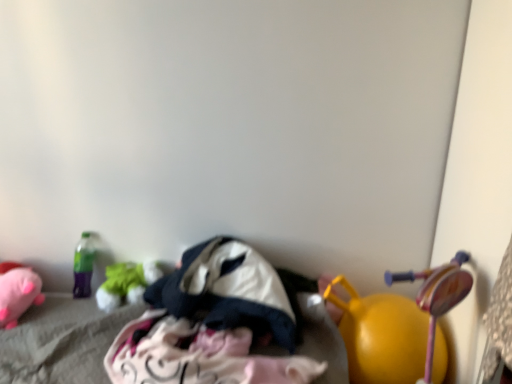
What are the coordinates of `soft pink plush at lower left, the first toy from the left` in the screenshot? It's located at (17, 292).

I want to click on yellow rubber ball at lower right, placed as the first toy when sorted from right to left, so click(x=381, y=335).

Is green fabric toy at left, the second toy in the right-to-left sequence, to the left or to the right of soft pink plush at lower left, the first toy from the left, in the image?

green fabric toy at left, the second toy in the right-to-left sequence, is to the right of soft pink plush at lower left, the first toy from the left.

Starting from the soft pink plush at lower left, the first toy from the left, which toy is the 1st one to the right? Please provide its 2D coordinates.

[(126, 283)]

From a real-world perspective, does green fabric toy at left, the second toy in the right-to-left sequence, sit lower than soft pink plush at lower left, the first toy from the left?

Yes.

Does green fabric toy at left, the second toy in the right-to-left sequence, lie behind soft pink plush at lower left, the first toy from the left?

Yes, the depth of green fabric toy at left, the second toy in the right-to-left sequence, is greater than that of soft pink plush at lower left, the first toy from the left.

Can you confirm if dark blue fabric at center, acting as the 2th clothing starting from the bottom, is positioned to the left of yellow rubber ball at lower right, arranged as the 3th toy when viewed from the left?

Yes, dark blue fabric at center, acting as the 2th clothing starting from the bottom, is to the left of yellow rubber ball at lower right, arranged as the 3th toy when viewed from the left.

Does dark blue fabric at center, acting as the 2th clothing starting from the bottom, have a smaller size compared to yellow rubber ball at lower right, placed as the first toy when sorted from right to left?

Incorrect, dark blue fabric at center, acting as the 2th clothing starting from the bottom, is not smaller in size than yellow rubber ball at lower right, placed as the first toy when sorted from right to left.

From a real-world perspective, which is physically below, dark blue fabric at center, acting as the 2th clothing starting from the bottom, or yellow rubber ball at lower right, placed as the first toy when sorted from right to left?

yellow rubber ball at lower right, placed as the first toy when sorted from right to left, is physically lower.

Is dark blue fabric at center, the first clothing when ordered from top to bottom, oriented away from yellow rubber ball at lower right, arranged as the 3th toy when viewed from the left?

No, dark blue fabric at center, the first clothing when ordered from top to bottom, is not facing the opposite direction of yellow rubber ball at lower right, arranged as the 3th toy when viewed from the left.

This screenshot has width=512, height=384. In order to click on the 2nd clothing in front of the green fabric toy at left, the second toy in the right-to-left sequence in this screenshot , I will do `click(197, 355)`.

Based on the photo, considering the relative sizes of white cotton clothes at center, marked as the 2th clothing in a top-to-bottom arrangement, and green fabric toy at left, the second toy in the right-to-left sequence, in the image provided, is white cotton clothes at center, marked as the 2th clothing in a top-to-bottom arrangement, bigger than green fabric toy at left, the second toy in the right-to-left sequence,?

Yes, white cotton clothes at center, marked as the 2th clothing in a top-to-bottom arrangement, is bigger than green fabric toy at left, the second toy in the right-to-left sequence.

Looking at this image, is white cotton clothes at center, which appears as the first clothing when ordered from the bottom, further to the viewer compared to green fabric toy at left, the second toy in the right-to-left sequence?

No, white cotton clothes at center, which appears as the first clothing when ordered from the bottom, is in front of green fabric toy at left, the second toy in the right-to-left sequence.

Is white cotton clothes at center, which appears as the first clothing when ordered from the bottom, facing towards green fabric toy at left, which is the 2th toy from left to right?

No.

Can you confirm if yellow rubber ball at lower right, placed as the first toy when sorted from right to left, is shorter than dark blue fabric at center, the first clothing when ordered from top to bottom?

In fact, yellow rubber ball at lower right, placed as the first toy when sorted from right to left, may be taller than dark blue fabric at center, the first clothing when ordered from top to bottom.

Is yellow rubber ball at lower right, placed as the first toy when sorted from right to left, oriented towards dark blue fabric at center, the first clothing when ordered from top to bottom?

No, yellow rubber ball at lower right, placed as the first toy when sorted from right to left, does not turn towards dark blue fabric at center, the first clothing when ordered from top to bottom.

Is yellow rubber ball at lower right, arranged as the 3th toy when viewed from the left, not close to dark blue fabric at center, acting as the 2th clothing starting from the bottom?

No, yellow rubber ball at lower right, arranged as the 3th toy when viewed from the left, is not far away from dark blue fabric at center, acting as the 2th clothing starting from the bottom.

Considering the relative sizes of yellow rubber ball at lower right, placed as the first toy when sorted from right to left, and dark blue fabric at center, the first clothing when ordered from top to bottom, in the image provided, is yellow rubber ball at lower right, placed as the first toy when sorted from right to left, wider than dark blue fabric at center, the first clothing when ordered from top to bottom,?

No, yellow rubber ball at lower right, placed as the first toy when sorted from right to left, is not wider than dark blue fabric at center, the first clothing when ordered from top to bottom.

Which object is positioned more to the right, soft pink plush at lower left, placed as the third toy when sorted from right to left, or dark blue fabric at center, acting as the 2th clothing starting from the bottom?

dark blue fabric at center, acting as the 2th clothing starting from the bottom, is more to the right.

Locate an element on the screen. The height and width of the screenshot is (384, 512). clothing that is the 1st one when counting forward from the soft pink plush at lower left, placed as the third toy when sorted from right to left is located at coordinates (228, 291).

Between point (10, 305) and point (183, 266), which one is positioned behind?

Point (183, 266)

Relative to dark blue fabric at center, the first clothing when ordered from top to bottom, is white cotton clothes at center, marked as the 2th clothing in a top-to-bottom arrangement, in front or behind?

Clearly, white cotton clothes at center, marked as the 2th clothing in a top-to-bottom arrangement, is in front of dark blue fabric at center, the first clothing when ordered from top to bottom.

Considering the points (159, 317) and (215, 311), which point is in front, point (159, 317) or point (215, 311)?

The point (215, 311) is in front.

Is white cotton clothes at center, marked as the 2th clothing in a top-to-bottom arrangement, situated inside dark blue fabric at center, acting as the 2th clothing starting from the bottom, or outside?

white cotton clothes at center, marked as the 2th clothing in a top-to-bottom arrangement, is spatially positioned inside dark blue fabric at center, acting as the 2th clothing starting from the bottom.

Which object is wider, white cotton clothes at center, marked as the 2th clothing in a top-to-bottom arrangement, or dark blue fabric at center, acting as the 2th clothing starting from the bottom?

Wider between the two is white cotton clothes at center, marked as the 2th clothing in a top-to-bottom arrangement.

How different are the orientations of green fabric toy at left, which is the 2th toy from left to right, and white cotton clothes at center, marked as the 2th clothing in a top-to-bottom arrangement, in degrees?

1.28e-05 degrees separate the facing orientations of green fabric toy at left, which is the 2th toy from left to right, and white cotton clothes at center, marked as the 2th clothing in a top-to-bottom arrangement.

From the image's perspective, which one is positioned lower, green fabric toy at left, which is the 2th toy from left to right, or white cotton clothes at center, which appears as the first clothing when ordered from the bottom?

white cotton clothes at center, which appears as the first clothing when ordered from the bottom, appears lower in the image.

Who is taller, green fabric toy at left, the second toy in the right-to-left sequence, or white cotton clothes at center, marked as the 2th clothing in a top-to-bottom arrangement?

With more height is white cotton clothes at center, marked as the 2th clothing in a top-to-bottom arrangement.

Is green fabric toy at left, which is the 2th toy from left to right, far from white cotton clothes at center, which appears as the first clothing when ordered from the bottom?

No, there isn't a large distance between green fabric toy at left, which is the 2th toy from left to right, and white cotton clothes at center, which appears as the first clothing when ordered from the bottom.

Locate an element on the screen. toy that is behind the soft pink plush at lower left, the first toy from the left is located at coordinates (126, 283).

The image size is (512, 384). Identify the location of toy in front of the dark blue fabric at center, acting as the 2th clothing starting from the bottom. (381, 335).

Based on their spatial positions, is green fabric toy at left, which is the 2th toy from left to right, or soft pink plush at lower left, the first toy from the left, closer to yellow rubber ball at lower right, placed as the first toy when sorted from right to left?

Based on the image, green fabric toy at left, which is the 2th toy from left to right, appears to be nearer to yellow rubber ball at lower right, placed as the first toy when sorted from right to left.

Considering their positions, is dark blue fabric at center, acting as the 2th clothing starting from the bottom, positioned further to soft pink plush at lower left, placed as the third toy when sorted from right to left, than green fabric toy at left, the second toy in the right-to-left sequence?

dark blue fabric at center, acting as the 2th clothing starting from the bottom, lies further to soft pink plush at lower left, placed as the third toy when sorted from right to left, than the other object.

Based on their spatial positions, is white cotton clothes at center, which appears as the first clothing when ordered from the bottom, or yellow rubber ball at lower right, placed as the first toy when sorted from right to left, closer to soft pink plush at lower left, placed as the third toy when sorted from right to left?

The object closer to soft pink plush at lower left, placed as the third toy when sorted from right to left, is white cotton clothes at center, which appears as the first clothing when ordered from the bottom.

From the picture: When comparing their distances from white cotton clothes at center, marked as the 2th clothing in a top-to-bottom arrangement, does green fabric toy at left, which is the 2th toy from left to right, or dark blue fabric at center, the first clothing when ordered from top to bottom, seem further?

green fabric toy at left, which is the 2th toy from left to right.

Looking at the image, which one is located closer to yellow rubber ball at lower right, arranged as the 3th toy when viewed from the left, white cotton clothes at center, marked as the 2th clothing in a top-to-bottom arrangement, or green fabric toy at left, the second toy in the right-to-left sequence?

Among the two, white cotton clothes at center, marked as the 2th clothing in a top-to-bottom arrangement, is located nearer to yellow rubber ball at lower right, arranged as the 3th toy when viewed from the left.

Looking at the image, which one is located further to soft pink plush at lower left, the first toy from the left, green fabric toy at left, which is the 2th toy from left to right, or white cotton clothes at center, which appears as the first clothing when ordered from the bottom?

Among the two, white cotton clothes at center, which appears as the first clothing when ordered from the bottom, is located further to soft pink plush at lower left, the first toy from the left.

Looking at the image, which one is located closer to soft pink plush at lower left, placed as the third toy when sorted from right to left, yellow rubber ball at lower right, arranged as the 3th toy when viewed from the left, or dark blue fabric at center, acting as the 2th clothing starting from the bottom?

dark blue fabric at center, acting as the 2th clothing starting from the bottom, is positioned closer to the anchor soft pink plush at lower left, placed as the third toy when sorted from right to left.

From the image, which object appears to be farther from white cotton clothes at center, which appears as the first clothing when ordered from the bottom, yellow rubber ball at lower right, arranged as the 3th toy when viewed from the left, or green fabric toy at left, the second toy in the right-to-left sequence?

yellow rubber ball at lower right, arranged as the 3th toy when viewed from the left, is positioned further to the anchor white cotton clothes at center, which appears as the first clothing when ordered from the bottom.

Where is `clothing between white cotton clothes at center, marked as the 2th clothing in a top-to-bottom arrangement, and yellow rubber ball at lower right, arranged as the 3th toy when viewed from the left, from left to right`? clothing between white cotton clothes at center, marked as the 2th clothing in a top-to-bottom arrangement, and yellow rubber ball at lower right, arranged as the 3th toy when viewed from the left, from left to right is located at coordinates (228, 291).

You are a GUI agent. You are given a task and a screenshot of the screen. Output one action in this format:
    pyautogui.click(x=<x>, y=<y>)
    Task: Click on the toy between soft pink plush at lower left, placed as the third toy when sorted from right to left, and white cotton clothes at center, which appears as the first clothing when ordered from the bottom
    This screenshot has height=384, width=512.
    Given the screenshot: What is the action you would take?
    pyautogui.click(x=126, y=283)

What are the coordinates of `clothing between soft pink plush at lower left, placed as the third toy when sorted from right to left, and dark blue fabric at center, acting as the 2th clothing starting from the bottom, from left to right` in the screenshot? It's located at (197, 355).

Where is `toy situated between soft pink plush at lower left, the first toy from the left, and yellow rubber ball at lower right, arranged as the 3th toy when viewed from the left, from left to right`? The height and width of the screenshot is (384, 512). toy situated between soft pink plush at lower left, the first toy from the left, and yellow rubber ball at lower right, arranged as the 3th toy when viewed from the left, from left to right is located at coordinates (126, 283).